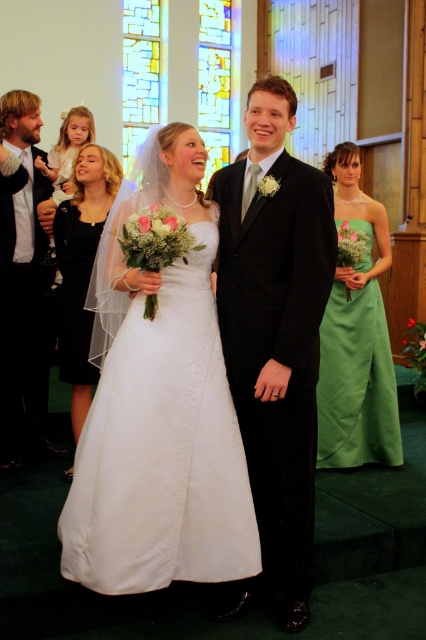
You are a photographer standing at the back of the church. You need to take a photo of the shiny black suit at left and the matte black dress at left. Which object should you focus on first if you want to capture both in one shot without moving the camera?

The shiny black suit at left is located below the matte black dress at left. Since the dress is above the suit, you should focus on the matte black dress at left first to ensure both are in focus, as depth of field might require starting with the closer object.

You are a photographer at the wedding and need to position two dresses in the frame. The white satin dress at center and the green satin dress at center are both in the scene. Which dress has a wider silhouette?

The white satin dress at center has a wider silhouette than the green satin dress at center, as its width surpasses the latter.

You are a photographer positioned at the back of the church. You need to capture a photo of the shiny black suit at left and the matte black dress at left such that both are fully visible in the frame. Considering their heights, which object should you focus on first to ensure both are in focus?

The shiny black suit at left is taller than the matte black dress at left. To ensure both are in focus, you should focus on the shiny black suit at left first, as it is taller and likely further away from the camera.